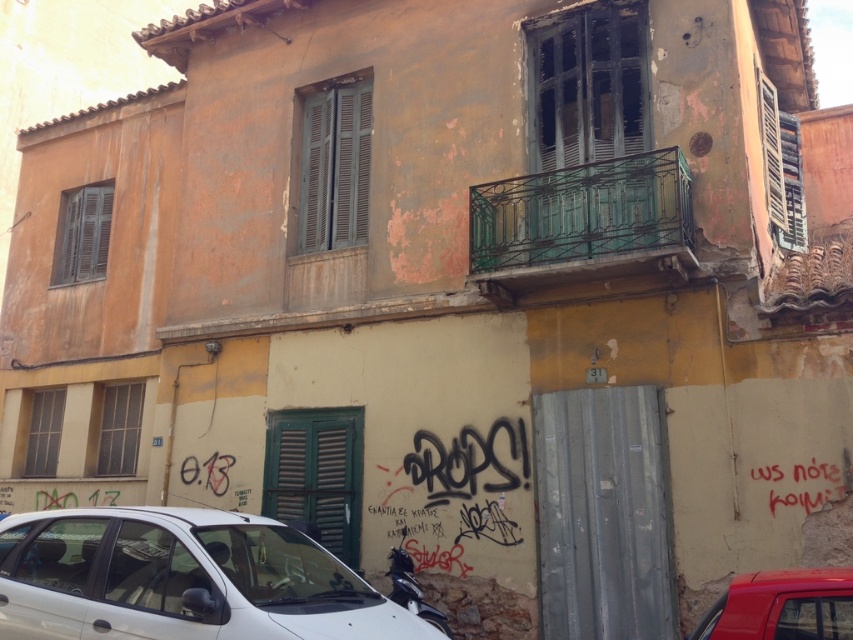
You are standing at the entrance of the building and want to locate two specific points marked on the facade. The first point is at coordinate point [229,566] and the second is at point [310,200]. Which point is closer to you when viewed from the entrance?

Point [229,566] is in front of point [310,200], so it is closer to you when viewed from the entrance.

You are standing at the entrance of the building and want to locate two specific points marked on the facade. The first point is at coordinates point (76, 515) and the second is at point (74, 228). Which of these points is closer to you as you face the building?

Point (76, 515) is in front of point (74, 228), so it is closer to you as you face the building.